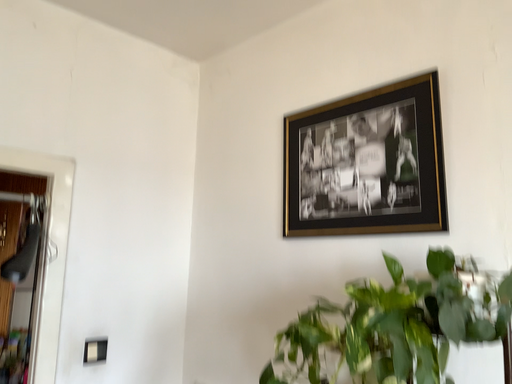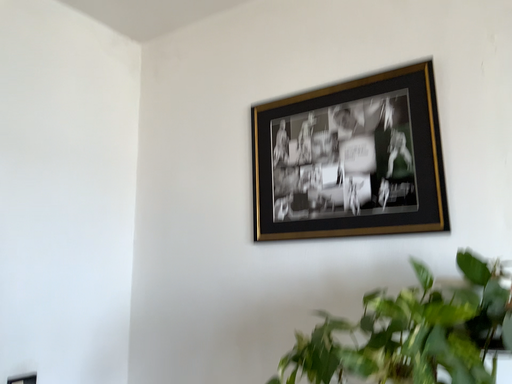
Question: Which way did the camera rotate in the video?

Choices:
 (A) rotated left
 (B) rotated right

Answer: (B)